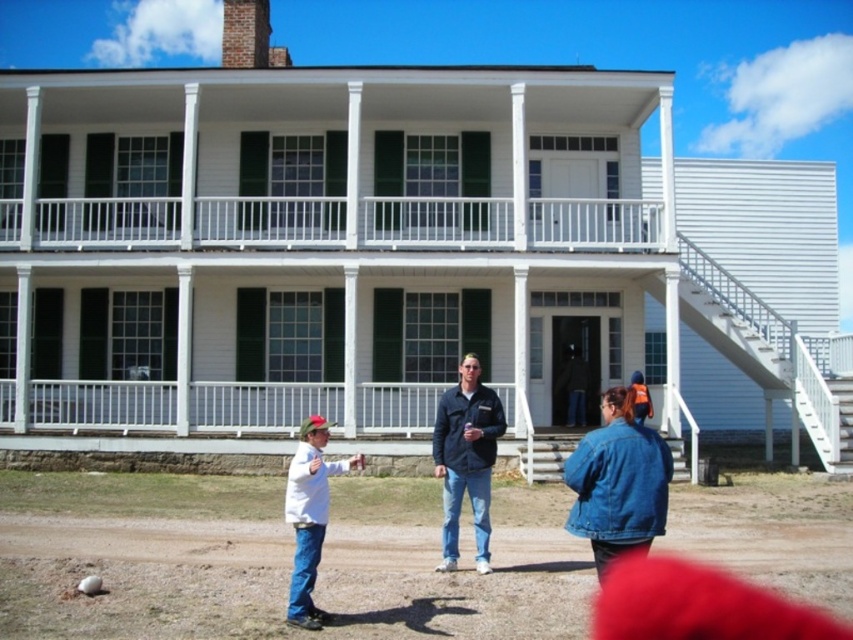
Is point (234, 234) in front of point (323, 468)?

No, it is not.

Can you confirm if white painted wood porch at upper center is positioned below white matte shirt at lower left?

Actually, white painted wood porch at upper center is above white matte shirt at lower left.

Is point (213, 227) in front of point (315, 620)?

No.

Where is `white painted wood porch at upper center`? This screenshot has width=853, height=640. white painted wood porch at upper center is located at coordinates (437, 221).

Which is more to the right, white painted wood porch at upper center or dark blue jacket at center?

dark blue jacket at center

Locate an element on the screen. white painted wood porch at upper center is located at coordinates (437, 221).

Which is above, dark blue jacket at center or white matte shirt at lower left?

dark blue jacket at center is higher up.

Between point (437, 476) and point (320, 548), which one is positioned in front?

Point (320, 548) is in front.

Describe the element at coordinates (466, 458) in the screenshot. I see `dark blue jacket at center` at that location.

What are the coordinates of `dark blue jacket at center` in the screenshot? It's located at (466, 458).